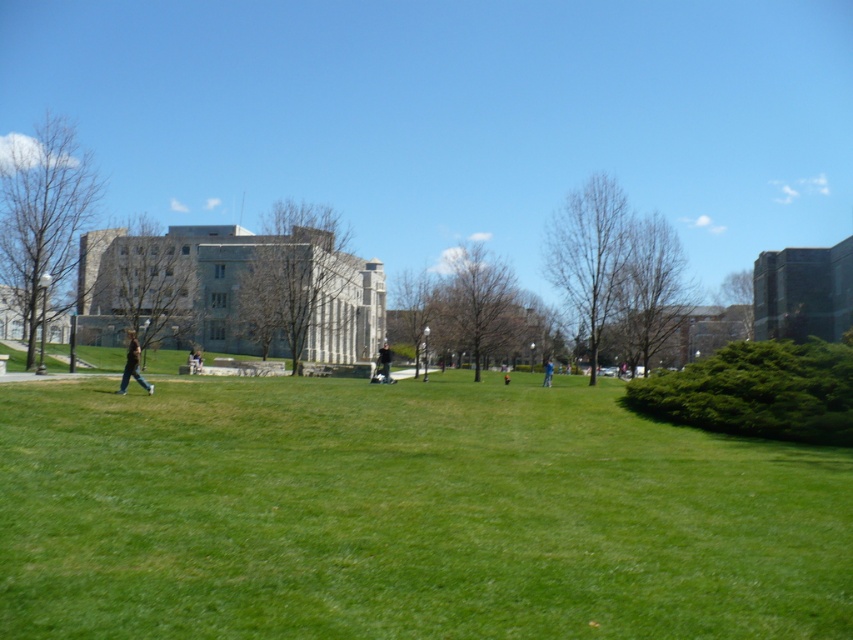
From the picture: You are standing at the center of the grassy area in the foreground of the university campus scene. You see two points marked in the image. Which point, point (224, 547) or point (379, 355), is closer to you?

Point (224, 547) is closer to the viewer than point (379, 355).

You are a photographer standing at the edge of the grassy area. You want to take a photo that includes both the light brown leather jacket at center and the blue fabric person at center. Which object should you focus on first to ensure both are in sharp focus?

You should focus on the light brown leather jacket at center first because it is closer to you than the blue fabric person at center. By focusing on the closer object, both will be in focus due to the depth of field.